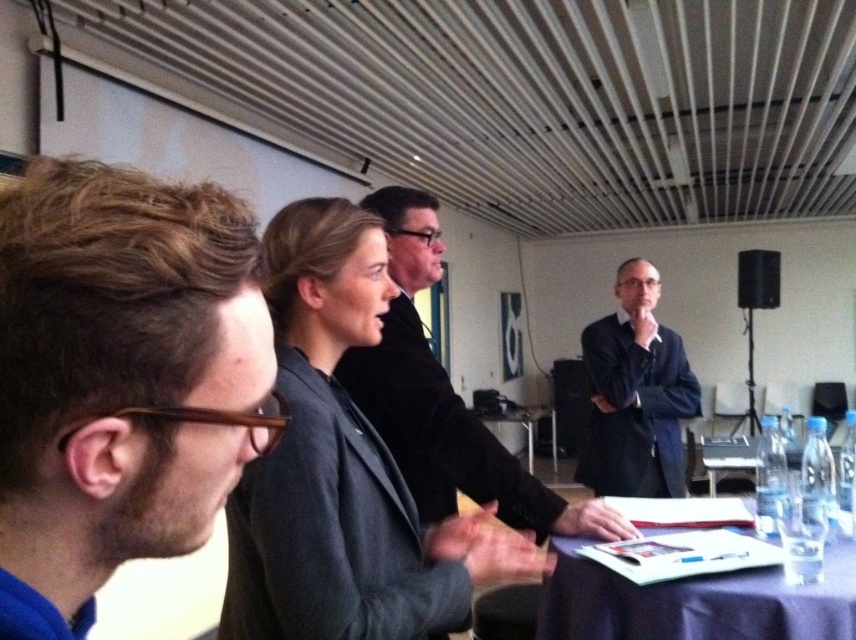
You are organizing a presentation in the conference room and need to place a laptop between the clear plastic bottles at lower right and the black matte speaker at upper right. Can the laptop fit between them horizontally if the laptop is 12 inches wide?

The clear plastic bottles at lower right are wider than the black matte speaker at upper right. However, since the laptop is 12 inches wide, we need to know the exact width of the space between them to determine if it fits. The provided information only compares their widths but doesn

You are standing in the conference room and want to place a 10cm wide notebook on the purple fabric table at lower right. The table is at coordinates 0.942, 0.814. Can you estimate if the notebook will fit on the table?

The purple fabric table at lower right is at coordinates (696, 602), but the description does not provide the table dimensions. Therefore, it is impossible to determine if the notebook will fit based on the given information.

You are organizing a presentation in the conference room and need to place a 12 cm tall document holder on the table. The clear plastic bottles at lower right and the black matte speaker at upper right are already there. Which object can the document holder be placed next to without blocking the view of the presenter?

The clear plastic bottles at lower right has a lesser height compared to the black matte speaker at upper right, so the document holder should be placed next to the clear plastic bottles at lower right to avoid blocking the presenter view.